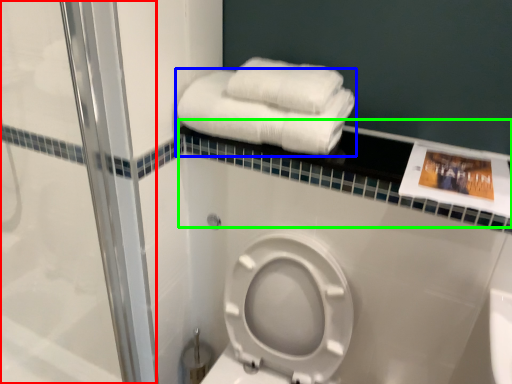
Question: Which object is positioned closest to shower door (highlighted by a red box)? Select from towel (highlighted by a blue box) and balustrade (highlighted by a green box).

Choices:
 (A) towel
 (B) balustrade

Answer: (A)